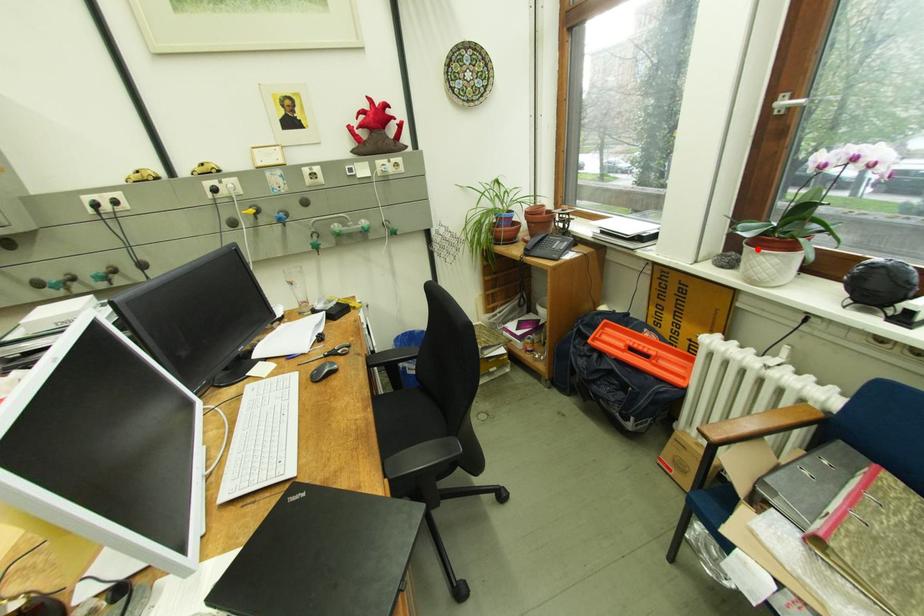
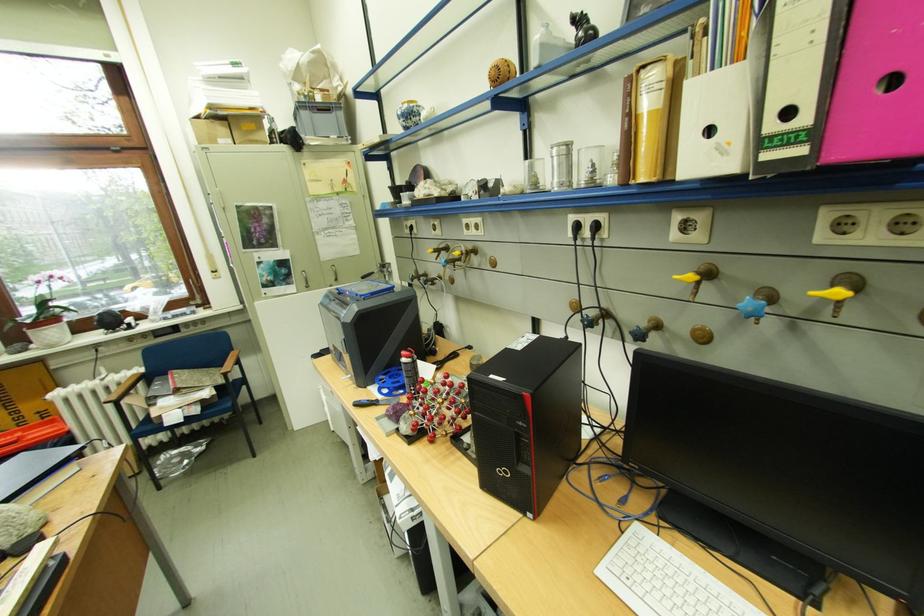
Locate, in the second image, the point that corresponds to the highlighted location in the first image.

(41, 334)